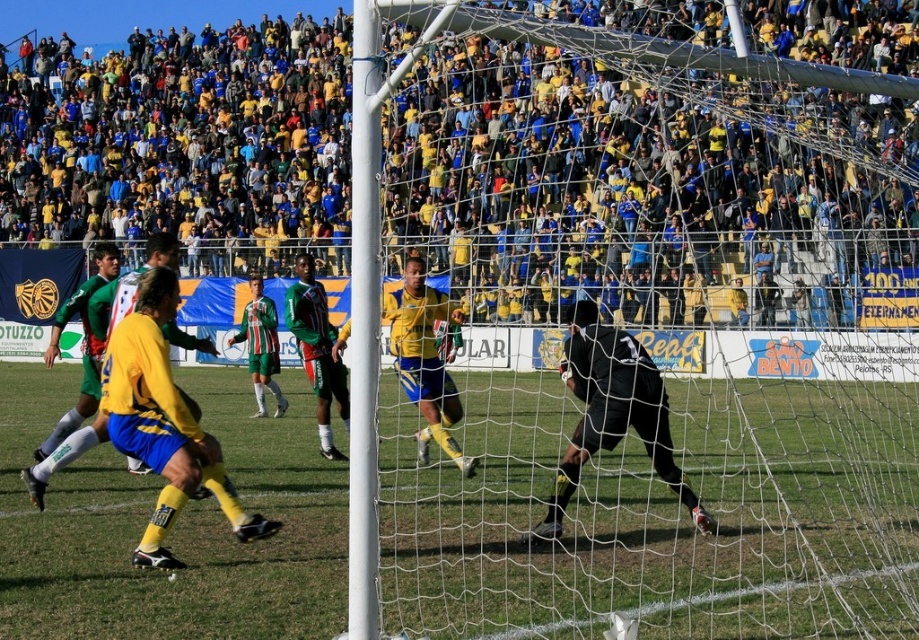
Based on the photo, is black matte/goalkeeper at center taller than green striped jersey at center?

Yes, black matte/goalkeeper at center is taller than green striped jersey at center.

Consider the image. Is black matte/goalkeeper at center below green striped jersey at center?

Incorrect, black matte/goalkeeper at center is not positioned below green striped jersey at center.

Is point (607, 356) behind point (263, 412)?

No.

Find the location of a particular element. black matte/goalkeeper at center is located at coordinates click(611, 412).

Can you confirm if yellow/yellowish fabric at upper center is shorter than green striped jersey at center?

No, yellow/yellowish fabric at upper center is not shorter than green striped jersey at center.

Is yellow/yellowish fabric at upper center wider than green striped jersey at center?

Correct, the width of yellow/yellowish fabric at upper center exceeds that of green striped jersey at center.

Which is in front, point (681, 244) or point (257, 413)?

Point (257, 413) is in front.

The width and height of the screenshot is (919, 640). I want to click on yellow/yellowish fabric at upper center, so click(506, 154).

Does yellow/yellowish fabric at upper center appear on the right side of green grass football field at center?

A: No, yellow/yellowish fabric at upper center is not to the right of green grass football field at center.

How much distance is there between yellow/yellowish fabric at upper center and green grass football field at center?

They are 33.16 feet apart.

Is point (759, 138) closer to viewer compared to point (234, 374)?

No, it is not.

Locate an element on the screen. The width and height of the screenshot is (919, 640). yellow/yellowish fabric at upper center is located at coordinates (506, 154).